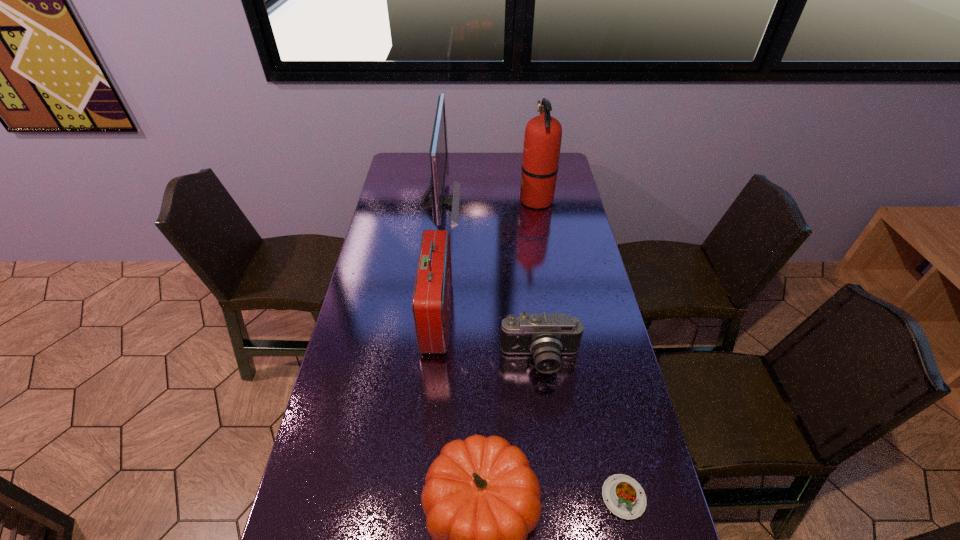
Where is `vacant point located on the front-facing side of the camera`? The width and height of the screenshot is (960, 540). vacant point located on the front-facing side of the camera is located at coordinates (552, 455).

Identify the location of vacant region located on the left of the shortest object. (464, 497).

Find the location of `object that is at the far edge`. object that is at the far edge is located at coordinates (438, 149).

The height and width of the screenshot is (540, 960). In order to click on object present at the left edge in this screenshot , I will do `click(438, 149)`.

You are a GUI agent. You are given a task and a screenshot of the screen. Output one action in this format:
    pyautogui.click(x=<x>, y=<y>)
    Task: Click on the fire extinguisher located in the right edge section of the desktop
    This screenshot has height=540, width=960.
    Given the screenshot: What is the action you would take?
    pyautogui.click(x=542, y=141)

I want to click on camera that is at the right edge, so click(546, 336).

Where is `pudding that is at the right edge`? Image resolution: width=960 pixels, height=540 pixels. pudding that is at the right edge is located at coordinates (624, 497).

Image resolution: width=960 pixels, height=540 pixels. Identify the location of object located at the far left corner. (438, 149).

The image size is (960, 540). I want to click on vacant space at the far edge, so click(x=456, y=176).

Locate an element on the screen. The image size is (960, 540). vacant space at the left edge is located at coordinates (334, 375).